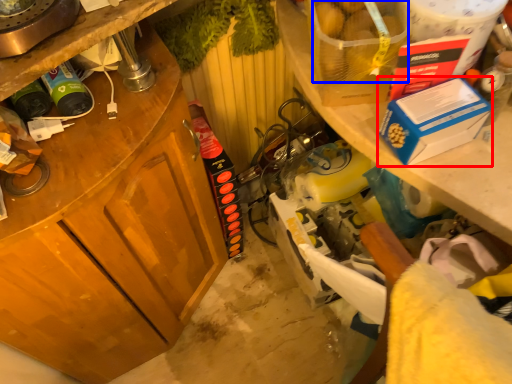
Question: Which of the following is the farthest to the observer, box (highlighted by a red box) or food (highlighted by a blue box)?

Choices:
 (A) box
 (B) food

Answer: (A)